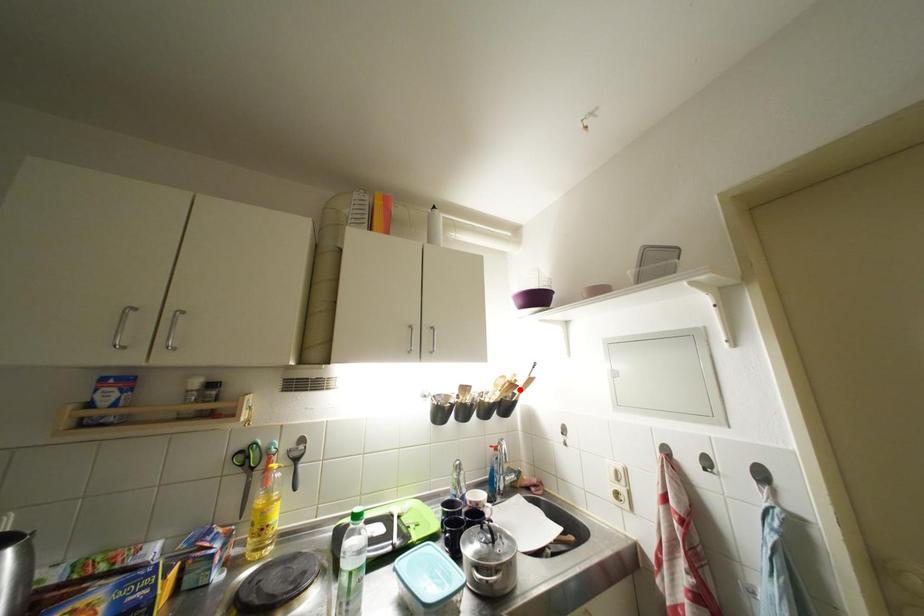
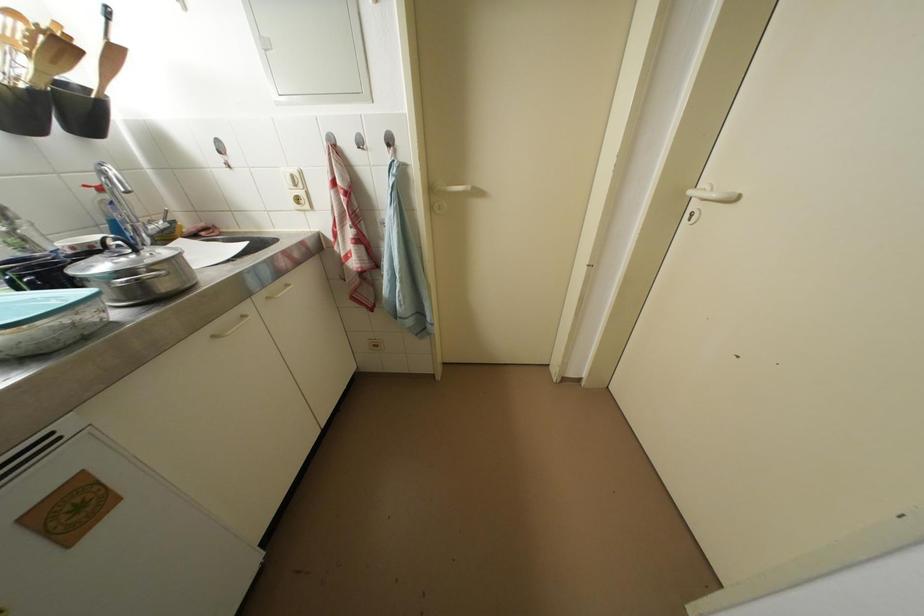
The point at the highlighted location is marked in the first image. Where is the corresponding point in the second image?

(69, 50)